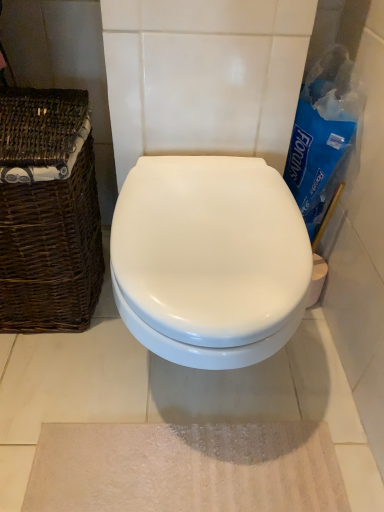
Question: From a real-world perspective, is beige textured bath mat at lower center physically above brown woven basket at left?

Choices:
 (A) yes
 (B) no

Answer: (B)

Question: From a real-world perspective, does beige textured bath mat at lower center sit lower than brown woven basket at left?

Choices:
 (A) no
 (B) yes

Answer: (B)

Question: Are beige textured bath mat at lower center and brown woven basket at left making contact?

Choices:
 (A) no
 (B) yes

Answer: (A)

Question: Can you confirm if beige textured bath mat at lower center is bigger than brown woven basket at left?

Choices:
 (A) yes
 (B) no

Answer: (B)

Question: Considering the relative sizes of beige textured bath mat at lower center and brown woven basket at left in the image provided, is beige textured bath mat at lower center shorter than brown woven basket at left?

Choices:
 (A) no
 (B) yes

Answer: (B)

Question: Is beige textured bath mat at lower center in front of brown woven basket at left?

Choices:
 (A) no
 (B) yes

Answer: (A)

Question: Is brown woven basket at left outside white glossy toilet at center?

Choices:
 (A) yes
 (B) no

Answer: (A)

Question: Does brown woven basket at left have a lesser height compared to white glossy toilet at center?

Choices:
 (A) yes
 (B) no

Answer: (B)

Question: From the image's perspective, does brown woven basket at left appear lower than white glossy toilet at center?

Choices:
 (A) no
 (B) yes

Answer: (A)

Question: Is brown woven basket at left turned away from white glossy toilet at center?

Choices:
 (A) yes
 (B) no

Answer: (B)

Question: From a real-world perspective, is brown woven basket at left on white glossy toilet at center?

Choices:
 (A) yes
 (B) no

Answer: (A)

Question: Could white glossy toilet at center be considered to be inside brown woven basket at left?

Choices:
 (A) no
 (B) yes

Answer: (A)

Question: Is white glossy toilet at center facing away from brown woven basket at left?

Choices:
 (A) no
 (B) yes

Answer: (A)